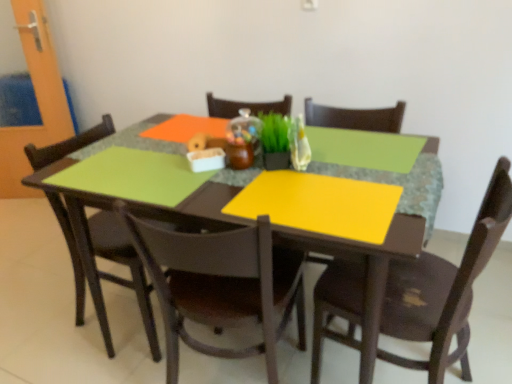
Question: Based on their sizes in the image, would you say matte brown chair at left, which ranks as the third chair in right-to-left order, is bigger or smaller than matte wooden table at center?

Choices:
 (A) small
 (B) big

Answer: (A)

Question: In the image, is matte brown chair at left, the 1th chair positioned from the left, positioned in front of or behind matte wooden table at center?

Choices:
 (A) front
 (B) behind

Answer: (B)

Question: Which of these objects is positioned farthest from the wooden chair at lower right, acting as the third chair starting from the left?

Choices:
 (A) yellow matte placemat at center
 (B) orange matte glass door at left
 (C) green matte plant at center
 (D) matte wooden table at center
 (E) matte brown chair at center, which is counted as the 2th chair, starting from the right

Answer: (B)

Question: Which of these objects is positioned farthest from the wooden chair at lower right, acting as the third chair starting from the left?

Choices:
 (A) orange matte glass door at left
 (B) green matte plant at center
 (C) yellow matte placemat at center
 (D) matte wooden table at center
 (E) matte brown chair at center, which ranks as the second chair in left-to-right order

Answer: (A)